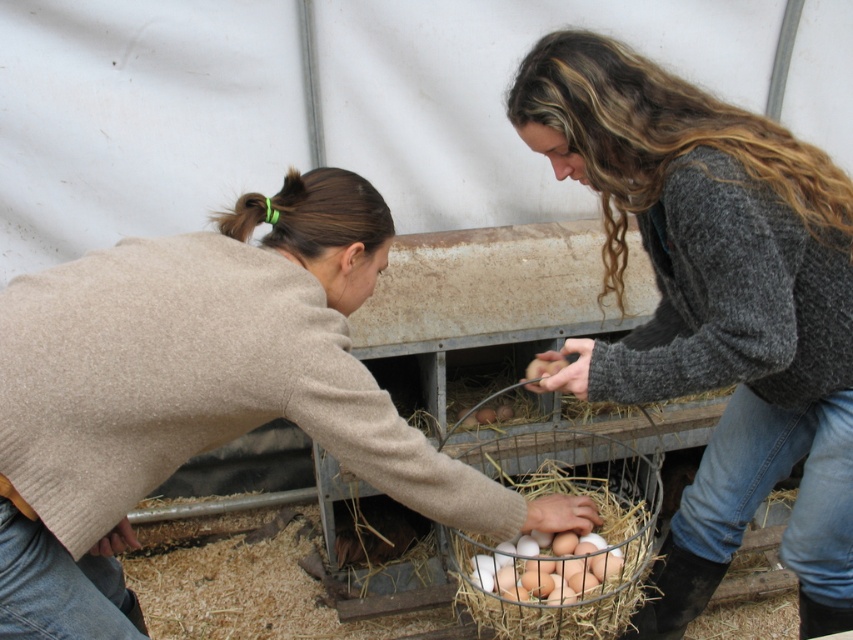
What do you see at coordinates (201, 392) in the screenshot? I see `beige wool sweater at lower left` at bounding box center [201, 392].

Which of these two, beige wool sweater at lower left or white matte eggs at center, stands shorter?

white matte eggs at center

Locate an element on the screen. The height and width of the screenshot is (640, 853). beige wool sweater at lower left is located at coordinates (201, 392).

You are a GUI agent. You are given a task and a screenshot of the screen. Output one action in this format:
    pyautogui.click(x=<x>, y=<y>)
    Task: Click on the beige wool sweater at lower left
    The height and width of the screenshot is (640, 853).
    Given the screenshot: What is the action you would take?
    pyautogui.click(x=201, y=392)

Does point (672, 602) come behind point (538, 548)?

Yes, it is.

Which is behind, point (822, 326) or point (570, 588)?

Point (570, 588)

At what (x,y) coordinates should I click in order to perform the action: click on gray sweater at upper right. Please return your answer as a coordinate pair (x, y). Looking at the image, I should click on (714, 307).

Between beige wool sweater at lower left and white straw nest at center, which one appears on the right side from the viewer's perspective?

white straw nest at center

Can you confirm if beige wool sweater at lower left is shorter than white straw nest at center?

Incorrect, beige wool sweater at lower left's height does not fall short of white straw nest at center's.

Between point (30, 296) and point (622, 576), which one is positioned in front?

Point (30, 296)

In order to click on beige wool sweater at lower left in this screenshot , I will do `click(201, 392)`.